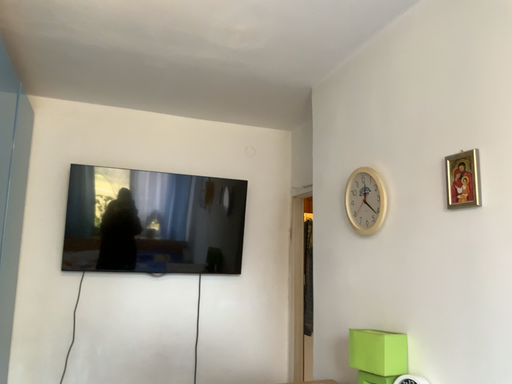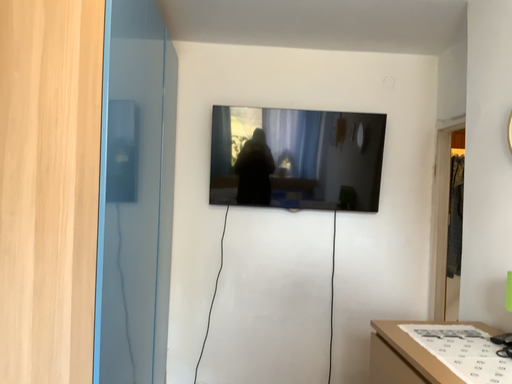
Question: Which way did the camera rotate in the video?

Choices:
 (A) rotated downward
 (B) rotated upward

Answer: (A)